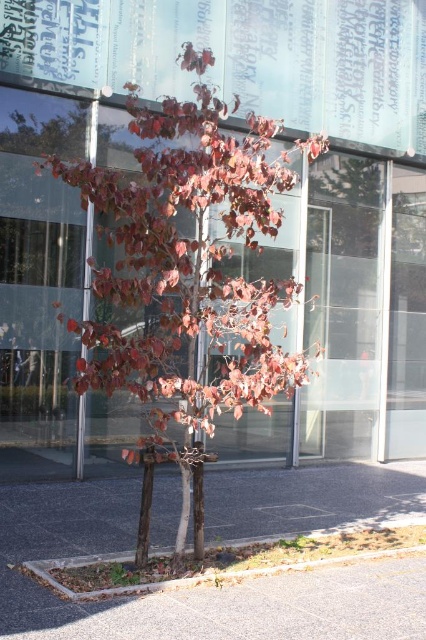
Question: From the image, what is the correct spatial relationship of reddish-brown bark tree at center in relation to brown asphalt at lower center?

Choices:
 (A) above
 (B) below

Answer: (A)

Question: Estimate the real-world distances between objects in this image. Which object is closer to the gray concrete curb at lower center?

Choices:
 (A) brown asphalt at lower center
 (B) reddish-brown bark tree at center

Answer: (A)

Question: Which of the following is the farthest from the observer?

Choices:
 (A) brown asphalt at lower center
 (B) gray concrete curb at lower center
 (C) reddish-brown bark tree at center

Answer: (A)

Question: Based on their relative distances, which object is farther from the gray concrete curb at lower center?

Choices:
 (A) brown asphalt at lower center
 (B) reddish-brown bark tree at center

Answer: (B)

Question: Considering the relative positions of reddish-brown bark tree at center and gray concrete curb at lower center in the image provided, where is reddish-brown bark tree at center located with respect to gray concrete curb at lower center?

Choices:
 (A) above
 (B) below

Answer: (A)

Question: Can you confirm if brown asphalt at lower center is positioned above gray concrete curb at lower center?

Choices:
 (A) yes
 (B) no

Answer: (A)